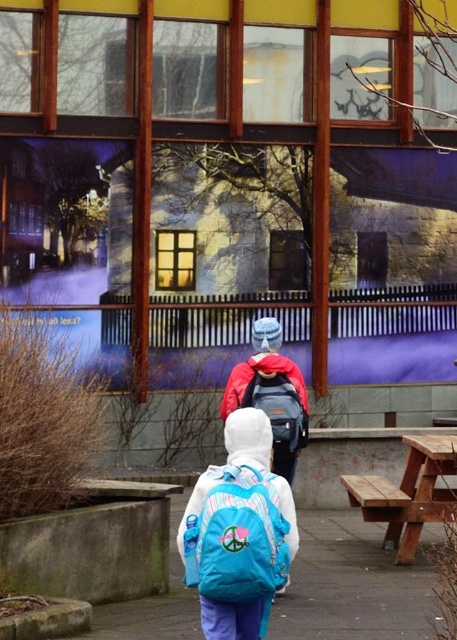
Question: In this image, where is brown wooden picnic table at lower right located relative to matte blue backpack at center?

Choices:
 (A) right
 (B) left

Answer: (A)

Question: Is blue fabric backpack at center closer to the viewer compared to matte blue backpack at center?

Choices:
 (A) no
 (B) yes

Answer: (B)

Question: Which object appears farthest from the camera in this image?

Choices:
 (A) matte blue backpack at center
 (B) blue fabric backpack at center

Answer: (A)

Question: Is blue fabric backpack at center positioned in front of brown wooden picnic table at lower right?

Choices:
 (A) no
 (B) yes

Answer: (B)

Question: Which point is closer to the camera?

Choices:
 (A) brown wooden picnic table at lower right
 (B) matte blue backpack at center
 (C) blue fabric backpack at lower center
 (D) blue fabric backpack at center

Answer: (D)

Question: Which point appears farthest from the camera in this image?

Choices:
 (A) (244, 563)
 (B) (281, 394)
 (C) (388, 536)
 (D) (373, 563)

Answer: (C)